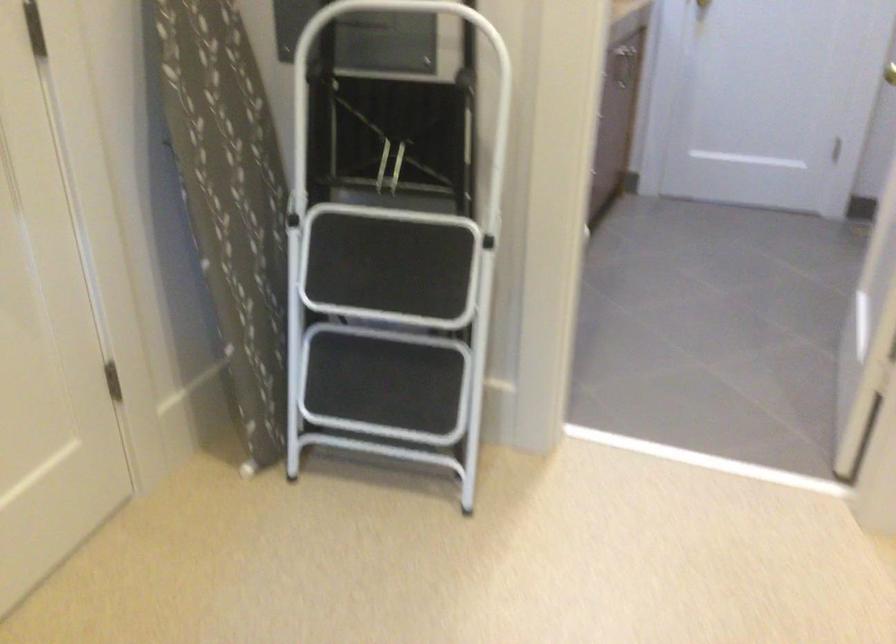
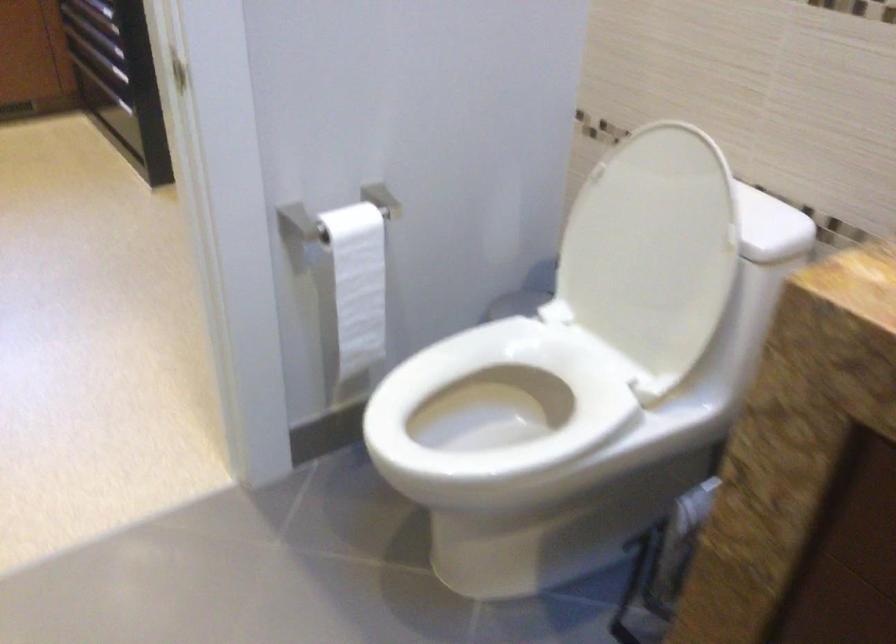
In the second image, find the point that corresponds to (x=495, y=269) in the first image.

(357, 283)